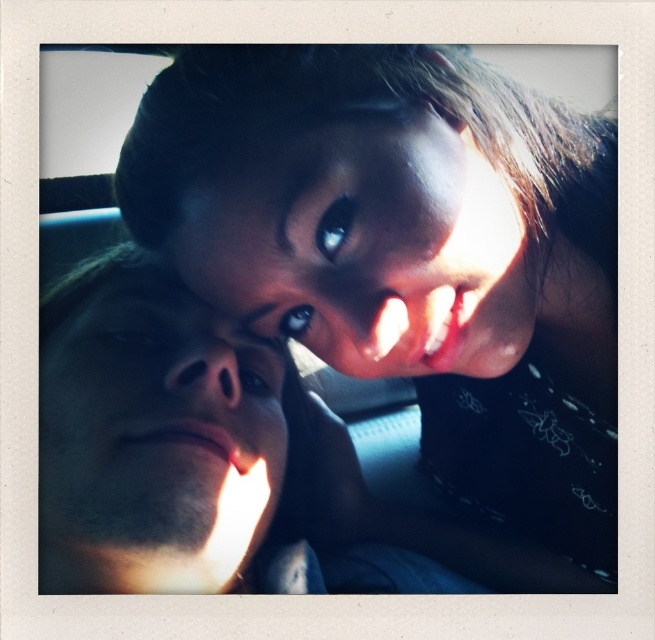
Question: Among these points, which one is farthest from the camera?

Choices:
 (A) (555, 257)
 (B) (443, 128)

Answer: (A)

Question: Is smooth skin face at left above smooth skin face at upper center?

Choices:
 (A) yes
 (B) no

Answer: (B)

Question: Can you confirm if matte black hair at upper center is smaller than smooth skin face at left?

Choices:
 (A) no
 (B) yes

Answer: (A)

Question: Is matte black hair at upper center to the left of smooth skin face at upper center from the viewer's perspective?

Choices:
 (A) yes
 (B) no

Answer: (B)

Question: Which of the following is the closest to the observer?

Choices:
 (A) (244, 465)
 (B) (493, 563)

Answer: (A)

Question: Considering the real-world distances, which object is closest to the matte black hair at upper center?

Choices:
 (A) smooth skin face at upper center
 (B) smooth skin face at left

Answer: (A)